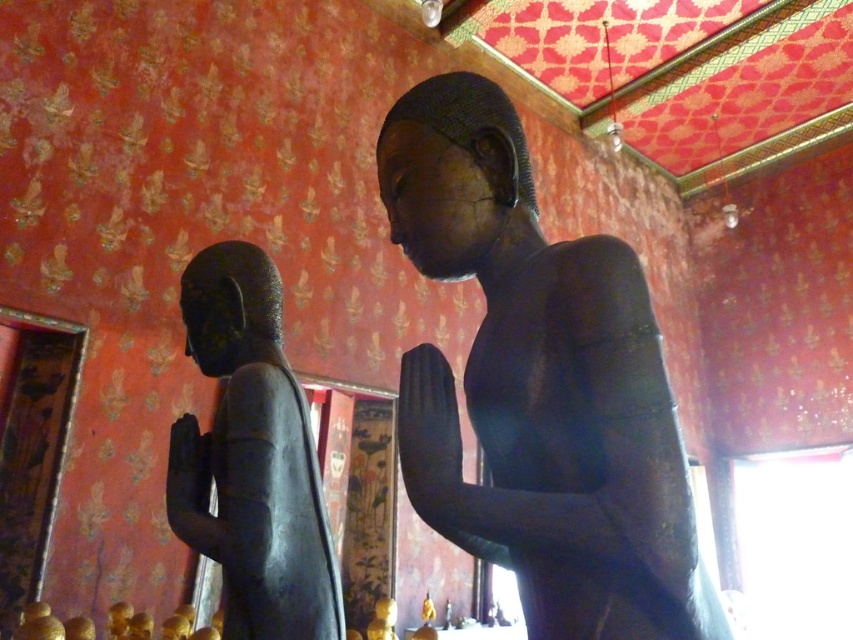
From the picture: You are an art curator planning to move the matte black statue at center and the matte black statue at left to a new exhibition space. If you want to maintain their original spatial relationship, which statue should be placed to the right of the other?

The matte black statue at center should be placed to the right of the matte black statue at left to maintain their original spatial relationship, as the statue at center was originally positioned on the right side of the statue at left.

You are an art conservator tasked with moving the matte black statue at center and the matte black statue at left from the temple to a museum. The museum has a display case that can only accommodate items up to 1.5 meters wide. Given that the statue at center is wider than the one on the left, which statue should you prioritize moving first to ensure it fits in the display case?

The matte black statue at left should be prioritized because the matte black statue at center is wider and may exceed the display case width limit of 1.5 meters, whereas the statue at left is narrower and more likely to fit.